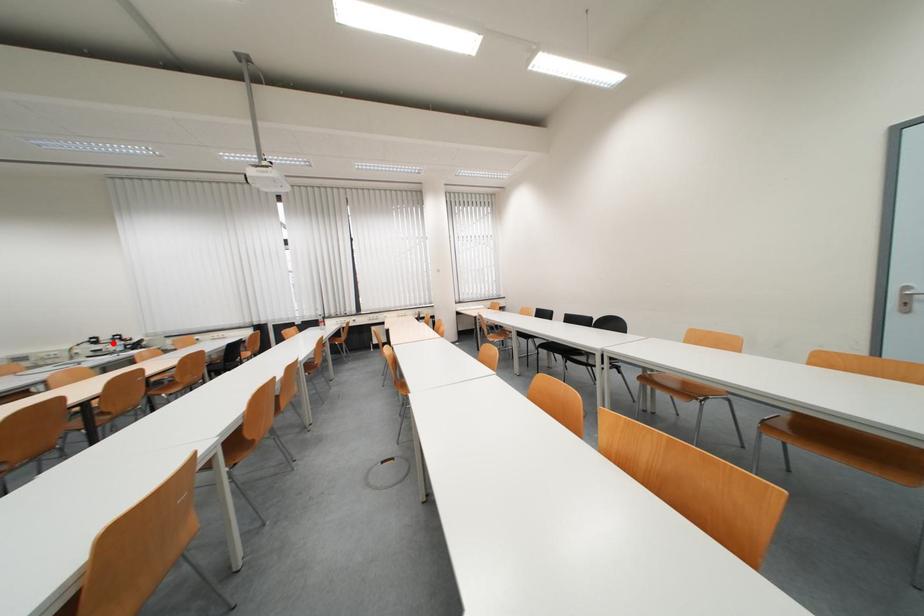
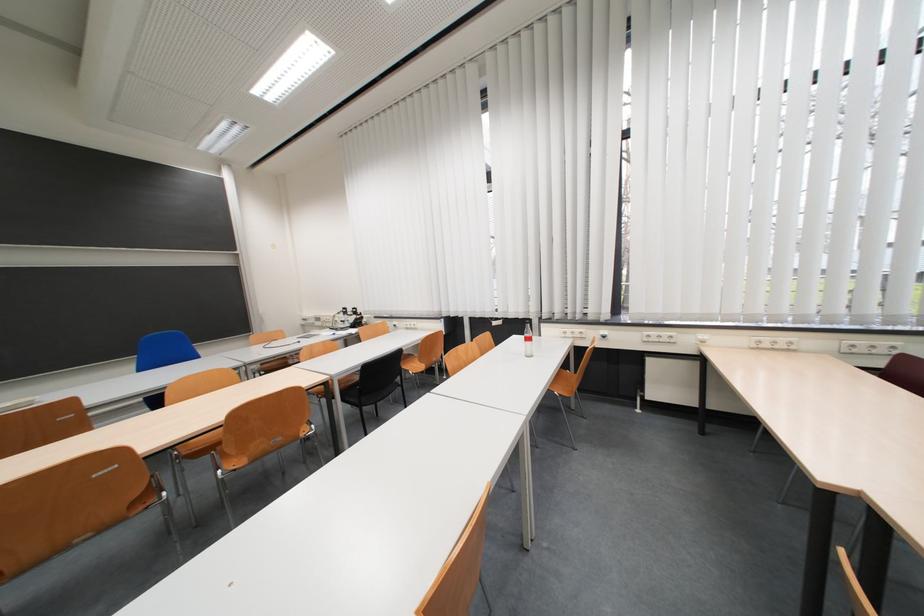
Locate, in the second image, the point that corresponds to the highlighted location in the first image.

(357, 315)